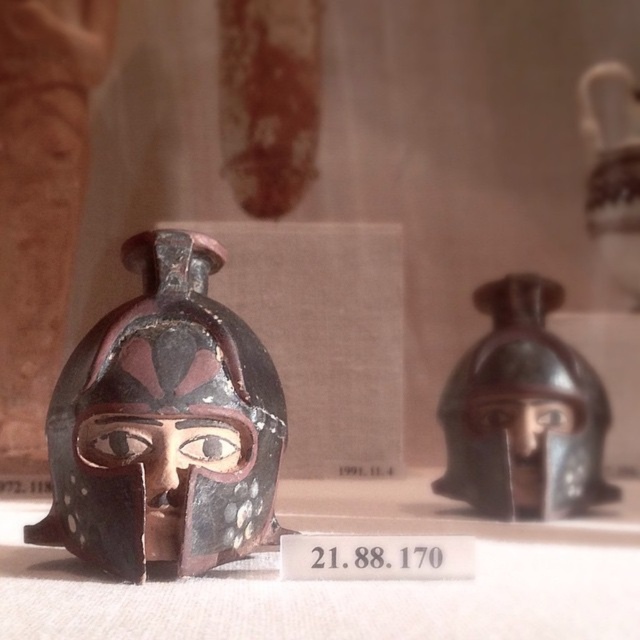
Does matte black helmet at left have a lesser width compared to matte black helmet at right?

Incorrect, matte black helmet at left's width is not less than matte black helmet at right's.

At what (x,y) coordinates should I click in order to perform the action: click on matte black helmet at left. Please return your answer as a coordinate pair (x, y). This screenshot has width=640, height=640. Looking at the image, I should click on (164, 424).

Identify the location of matte black helmet at left. The width and height of the screenshot is (640, 640). (164, 424).